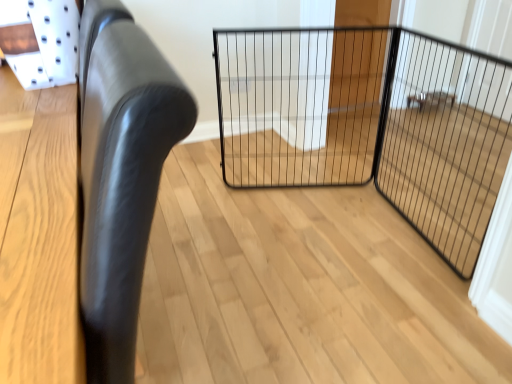
I want to click on free spot behind black wire mesh screen door at center, so click(356, 192).